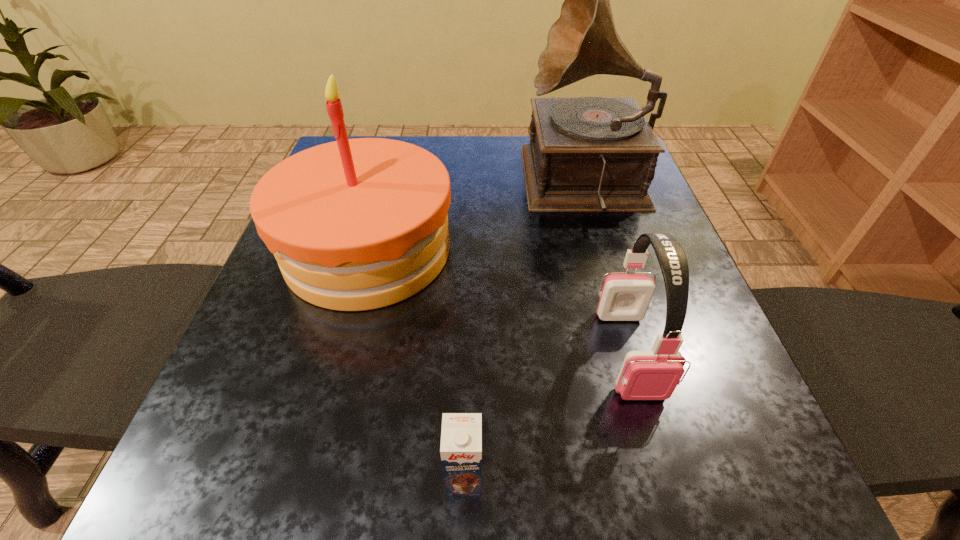
What are the coordinates of `empty space that is in between the third tallest object and the chocolate milk` in the screenshot? It's located at (546, 415).

In order to click on free spot between the third shortest object and the shortest object in this screenshot , I will do `click(416, 364)`.

Identify which object is the third nearest to the earphone. Please provide its 2D coordinates. Your answer should be formatted as a tuple, i.e. [(x, y)], where the tuple contains the x and y coordinates of a point satisfying the conditions above.

[(358, 224)]

Choose which object is the nearest neighbor to the nearest object. Please provide its 2D coordinates. Your answer should be formatted as a tuple, i.e. [(x, y)], where the tuple contains the x and y coordinates of a point satisfying the conditions above.

[(653, 374)]

At what (x,y) coordinates should I click in order to perform the action: click on free space that satisfies the following two spatial constraints: 1. from the horn of the tallest object; 2. on the outer surface of the third tallest object. Please return your answer as a coordinate pair (x, y). Looking at the image, I should click on (637, 352).

The height and width of the screenshot is (540, 960). I want to click on free location that satisfies the following two spatial constraints: 1. from the horn of the record player; 2. on the outer surface of the third tallest object, so point(637,352).